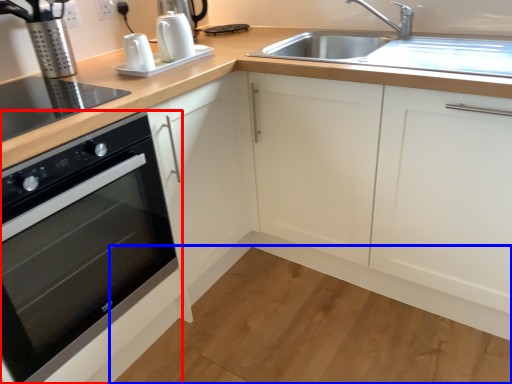
Question: Which of the following is the closest to the observer, home appliance (highlighted by a red box) or plain (highlighted by a blue box)?

Choices:
 (A) home appliance
 (B) plain

Answer: (A)